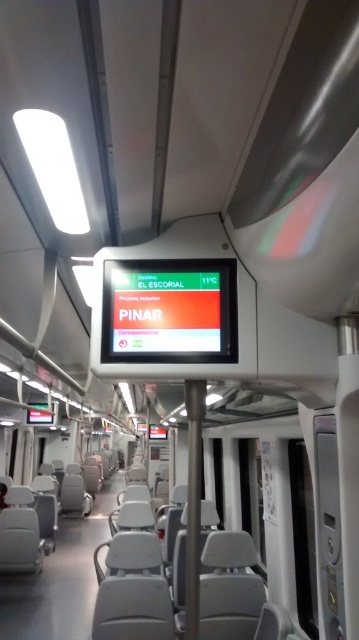
Question: Which object appears closest to the camera in this image?

Choices:
 (A) metallic pole at center
 (B) matte orange display at center

Answer: (A)

Question: Is matte orange display at center below metallic pole at center?

Choices:
 (A) yes
 (B) no

Answer: (B)

Question: Can you confirm if matte orange display at center is wider than metallic pole at center?

Choices:
 (A) yes
 (B) no

Answer: (A)

Question: Which object appears closest to the camera in this image?

Choices:
 (A) metallic pole at center
 (B) matte orange display at center

Answer: (A)

Question: Is matte orange display at center smaller than metallic pole at center?

Choices:
 (A) yes
 (B) no

Answer: (A)